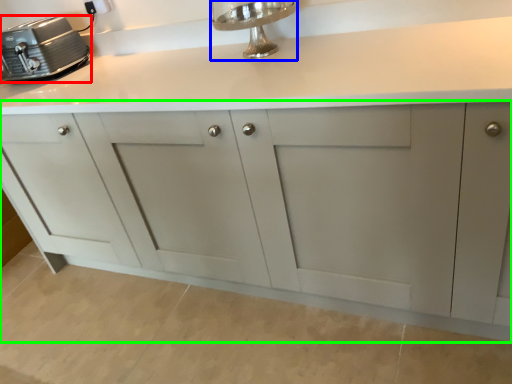
Question: Which object is positioned farthest from home appliance (highlighted by a red box)? Select from faucet (highlighted by a blue box) and cabinetry (highlighted by a green box).

Choices:
 (A) faucet
 (B) cabinetry

Answer: (A)